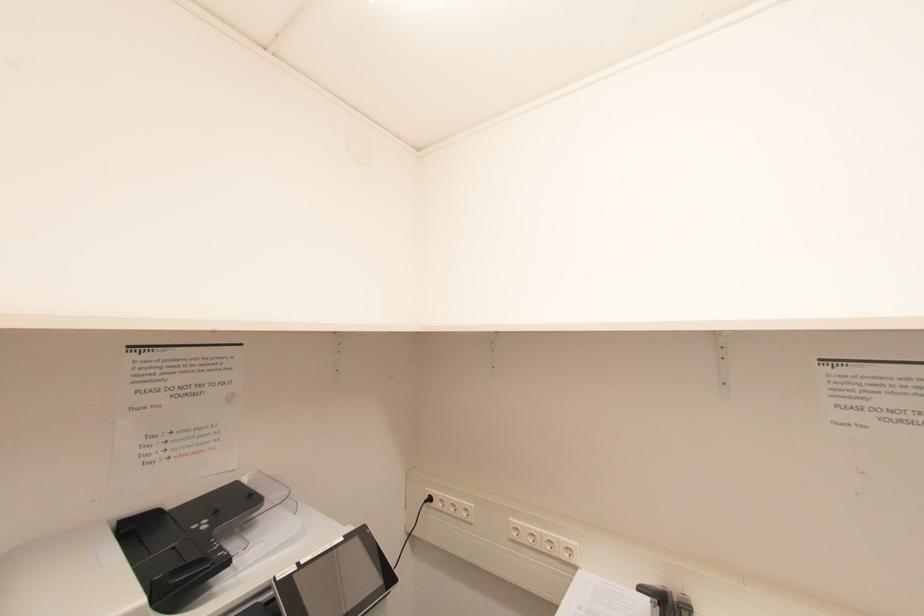
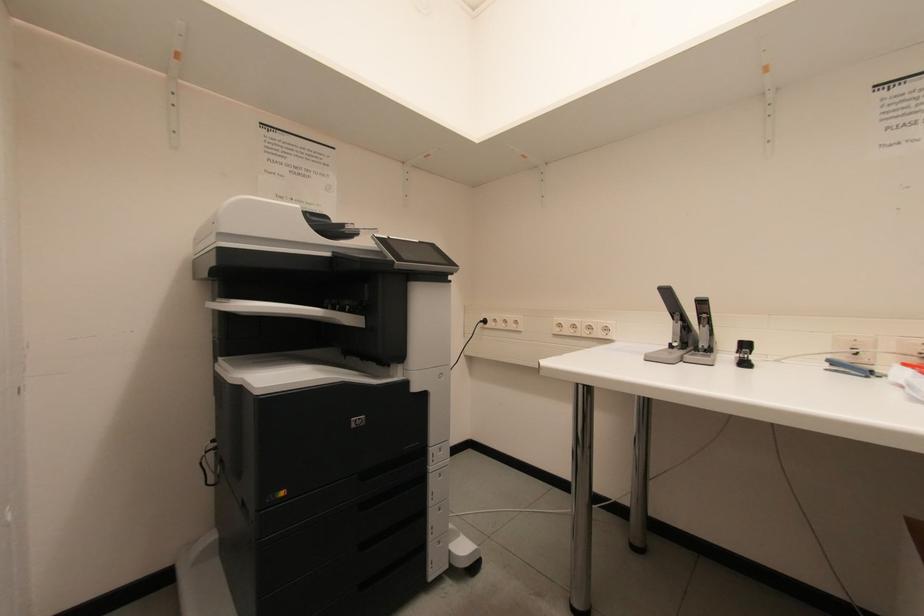
Question: How did the camera likely rotate?

Choices:
 (A) Left
 (B) Right
 (C) Up
 (D) Down

Answer: (A)